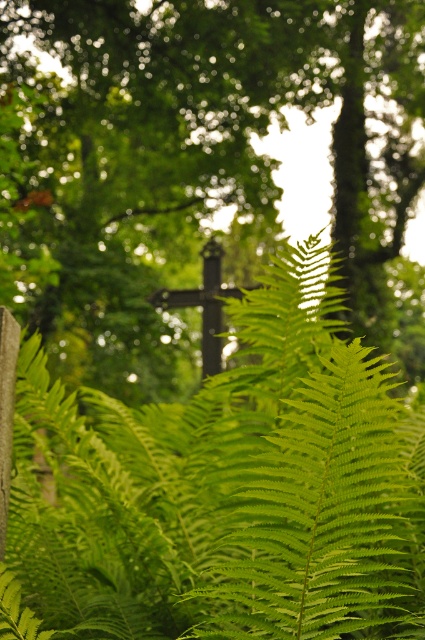
You are standing in a cemetery and want to place a small offering between the green leafy fern at lower center and the green leafy fern at center. Which fern should you place it closer to in order to ensure it is visible from your current position?

You should place the offering closer to the green leafy fern at lower center because it is closer to you than the green leafy fern at center, making it more visible from your current position.

You are a botanist studying fern growth in this area. You observe two ferns in the scene. Which fern, the green leafy fern at lower center or the green leafy fern at center, is taller?

The green leafy fern at lower center is taller than the green leafy fern at center.

You are a photographer trying to capture both the green leafy fern at lower center and the dark brown wooden cross at center in a single frame. Which object will appear closer to the camera in the photo?

The green leafy fern at lower center will appear closer to the camera because it is positioned in the foreground and is larger in size than the dark brown wooden cross at center.